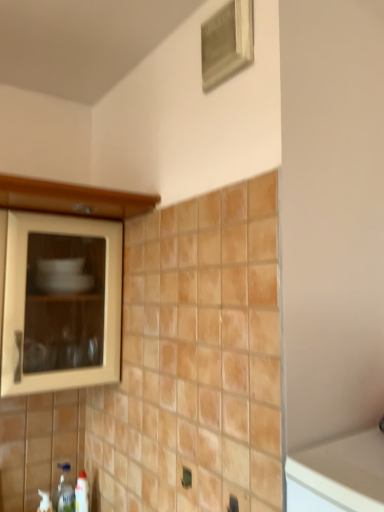
Looking at this image, in order to face wooden frame at upper center, should I rotate leftwards or rightwards?

Turn right by 3.838 degrees to look at wooden frame at upper center.

What do you see at coordinates (227, 42) in the screenshot?
I see `wooden frame at upper center` at bounding box center [227, 42].

In order to click on wooden frame at upper center in this screenshot , I will do `click(227, 42)`.

Where is `wooden frame at upper center`? Image resolution: width=384 pixels, height=512 pixels. wooden frame at upper center is located at coordinates (227, 42).